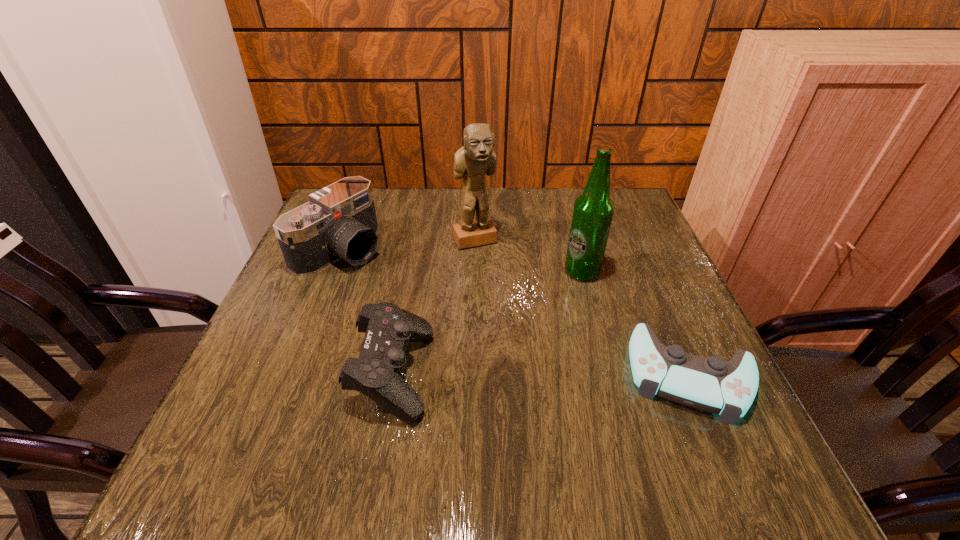
What are the coordinates of `object that is the nearest to the beer bottle` in the screenshot? It's located at (710, 384).